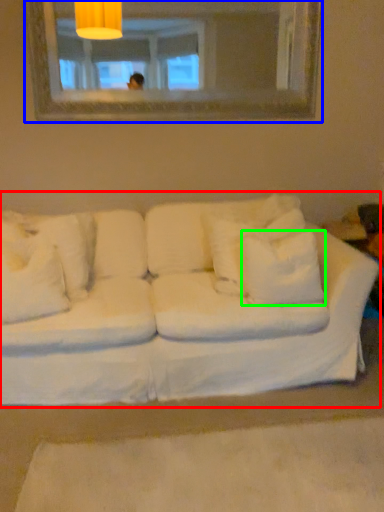
Question: Considering the real-world distances, which object is closest to studio couch (highlighted by a red box)? mirror (highlighted by a blue box) or pillow (highlighted by a green box).

Choices:
 (A) mirror
 (B) pillow

Answer: (B)